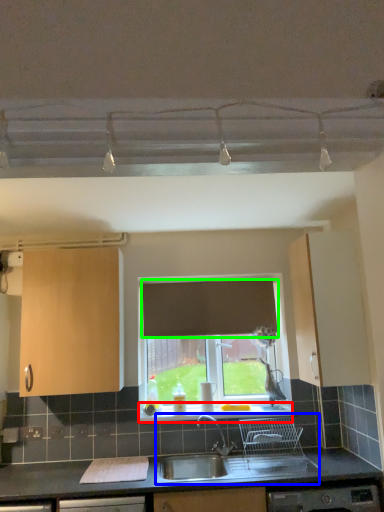
Question: Which is nearer to the window sill (highlighted by a red box)? sink (highlighted by a blue box) or curtain (highlighted by a green box).

Choices:
 (A) sink
 (B) curtain

Answer: (A)